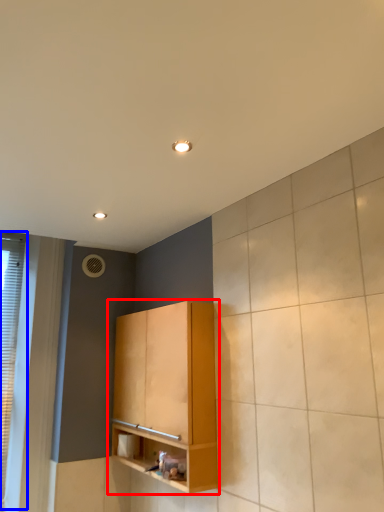
Question: Which object is further to the camera taking this photo, cabinetry (highlighted by a red box) or window (highlighted by a blue box)?

Choices:
 (A) cabinetry
 (B) window

Answer: (B)